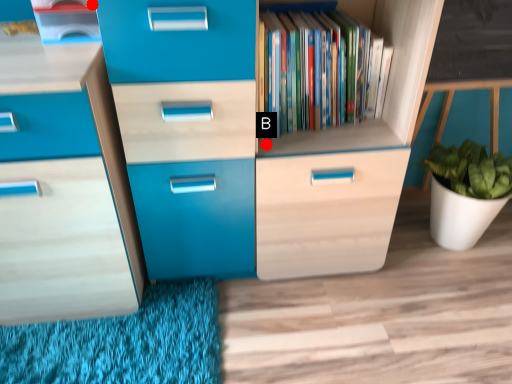
Question: Two points are circled on the image, labeled by A and B beside each circle. Which point is further to the camera?

Choices:
 (A) A is further
 (B) B is further

Answer: (B)